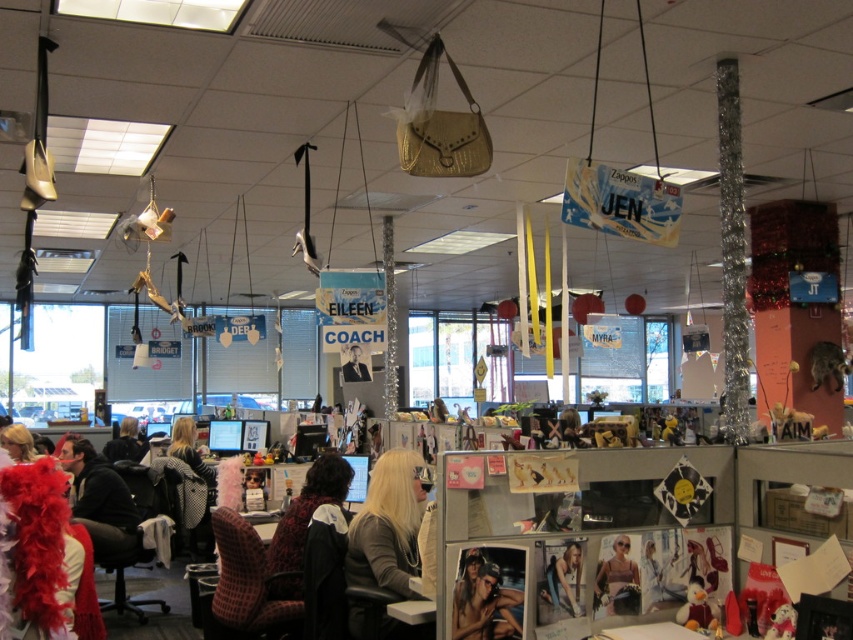
Question: Is plaid fabric chair at lower left to the left of matte black suit at center from the viewer's perspective?

Choices:
 (A) yes
 (B) no

Answer: (A)

Question: Does matte purple dress at center appear on the left side of blonde hair at lower left?

Choices:
 (A) no
 (B) yes

Answer: (A)

Question: Which of the following is the farthest from the observer?

Choices:
 (A) black leather chair at center
 (B) velvet-patterned chair at center
 (C) dark brown leather jacket at center

Answer: (B)

Question: Which of the following is the farthest from the observer?

Choices:
 (A) (618, 552)
 (B) (439, 417)
 (C) (233, 605)

Answer: (B)

Question: Does smooth beige fabric at lower center have a greater width compared to matte purple dress at center?

Choices:
 (A) yes
 (B) no

Answer: (B)

Question: Which point is farther to the camera?

Choices:
 (A) (181, 433)
 (B) (234, 608)

Answer: (A)